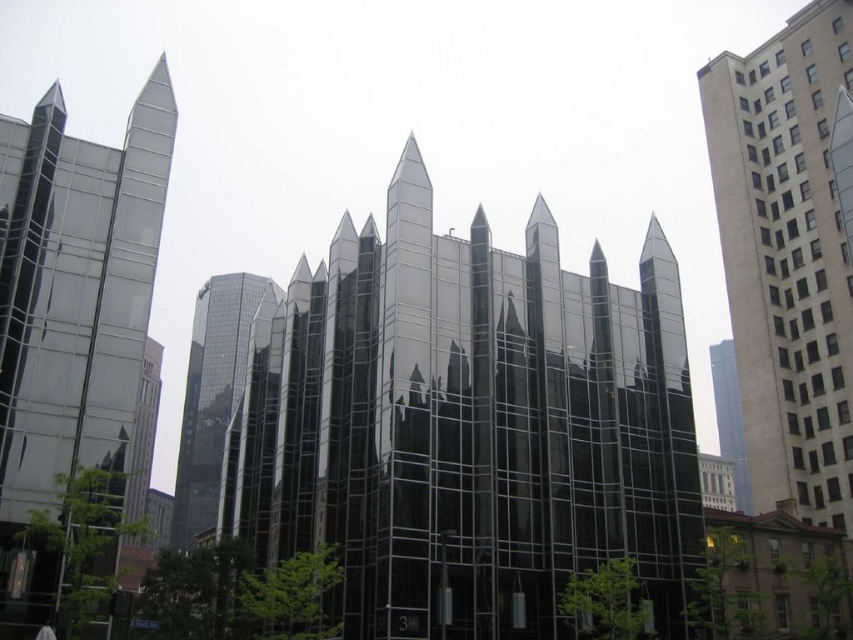
Who is shorter, shiny glass building at center or beige concrete building at right?

shiny glass building at center is shorter.

Is shiny glass building at center below beige concrete building at right?

Yes.

Is point (502, 467) closer to camera compared to point (808, 337)?

Yes.

Identify the location of shiny glass building at center. This screenshot has width=853, height=640. (468, 426).

Who is taller, polished glass skyscraper at left or beige concrete building at right?

With more height is beige concrete building at right.

Who is shorter, polished glass skyscraper at left or beige concrete building at right?

polished glass skyscraper at left

Describe the element at coordinates (71, 310) in the screenshot. I see `polished glass skyscraper at left` at that location.

Identify the location of polished glass skyscraper at left. The image size is (853, 640). (71, 310).

Measure the distance from shiny glass building at center to glossy glass tower at center.

shiny glass building at center and glossy glass tower at center are 38.99 meters apart from each other.

Which of these two, shiny glass building at center or glossy glass tower at center, stands shorter?

shiny glass building at center

Image resolution: width=853 pixels, height=640 pixels. Describe the element at coordinates (468, 426) in the screenshot. I see `shiny glass building at center` at that location.

The image size is (853, 640). Find the location of `shiny glass building at center`. shiny glass building at center is located at coordinates (468, 426).